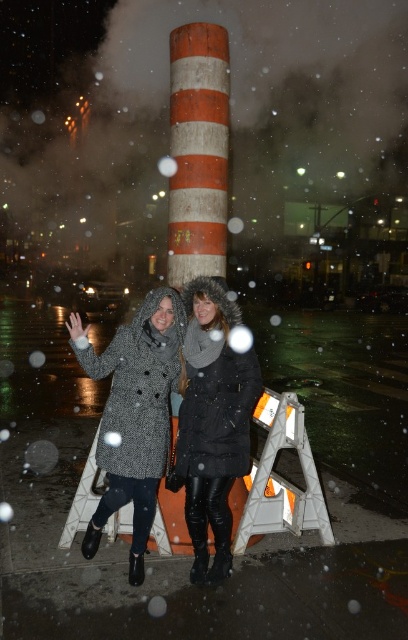
Is textured wool coat at center wider than black leather coat at center?

Indeed, textured wool coat at center has a greater width compared to black leather coat at center.

The height and width of the screenshot is (640, 408). Describe the element at coordinates (168, 410) in the screenshot. I see `textured wool coat at center` at that location.

The width and height of the screenshot is (408, 640). What are the coordinates of `textured wool coat at center` in the screenshot? It's located at [x=168, y=410].